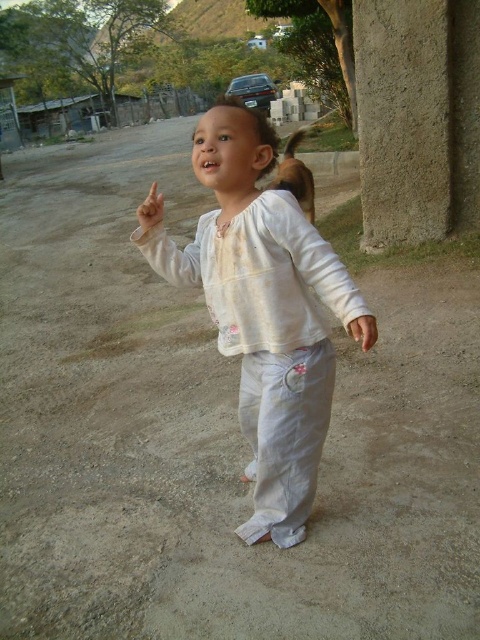
The child in the image is holding a white cotton baby doll and has a light beige fabric hand visible above them. Which object is taller, the white cotton baby at center or the light beige fabric hand at upper center?

The light beige fabric hand at upper center is taller than the white cotton baby at center.

You are a photographer trying to capture the perfect shot of the white cotton baby at center and the light beige fabric hand at upper center. To ensure both objects are in focus, you need to know which one is wider. Can you tell me which object has a greater width?

The light beige fabric hand at upper center has a greater width than the white cotton baby at center, as the white cotton baby at center is narrower.